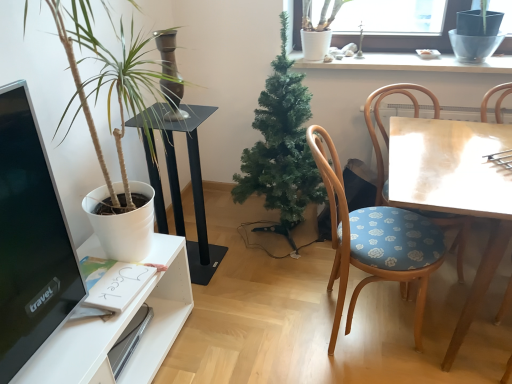
Question: From a real-world perspective, is white ceramic vase at upper center physically above black glass table at center?

Choices:
 (A) yes
 (B) no

Answer: (A)

Question: From the image's perspective, does white ceramic vase at upper center appear higher than black glass table at center?

Choices:
 (A) no
 (B) yes

Answer: (B)

Question: Is white ceramic vase at upper center further to camera compared to black glass table at center?

Choices:
 (A) yes
 (B) no

Answer: (A)

Question: Is white ceramic vase at upper center next to black glass table at center and touching it?

Choices:
 (A) no
 (B) yes

Answer: (A)

Question: From a real-world perspective, is white ceramic vase at upper center below black glass table at center?

Choices:
 (A) yes
 (B) no

Answer: (B)

Question: Is white ceramic vase at upper center far away from black glass table at center?

Choices:
 (A) no
 (B) yes

Answer: (A)

Question: Considering the relative sizes of black glass table at center and wooden chair with blue floral cushion at right, positioned as the first chair in left-to-right order, in the image provided, is black glass table at center thinner than wooden chair with blue floral cushion at right, positioned as the first chair in left-to-right order,?

Choices:
 (A) yes
 (B) no

Answer: (A)

Question: From a real-world perspective, is black glass table at center physically below wooden chair with blue floral cushion at right, arranged as the second chair when viewed from the right?

Choices:
 (A) yes
 (B) no

Answer: (A)

Question: Does black glass table at center lie behind wooden chair with blue floral cushion at right, positioned as the first chair in left-to-right order?

Choices:
 (A) no
 (B) yes

Answer: (B)

Question: Can you confirm if black glass table at center is bigger than wooden chair with blue floral cushion at right, arranged as the second chair when viewed from the right?

Choices:
 (A) no
 (B) yes

Answer: (A)

Question: Considering the relative sizes of black glass table at center and wooden chair with blue floral cushion at right, positioned as the first chair in left-to-right order, in the image provided, is black glass table at center smaller than wooden chair with blue floral cushion at right, positioned as the first chair in left-to-right order,?

Choices:
 (A) no
 (B) yes

Answer: (B)

Question: Does black glass table at center have a lesser height compared to wooden chair with blue floral cushion at right, arranged as the second chair when viewed from the right?

Choices:
 (A) yes
 (B) no

Answer: (A)

Question: Is wooden chair with floral cushion at right, placed as the first chair when sorted from right to left, located outside wooden table at right?

Choices:
 (A) no
 (B) yes

Answer: (A)